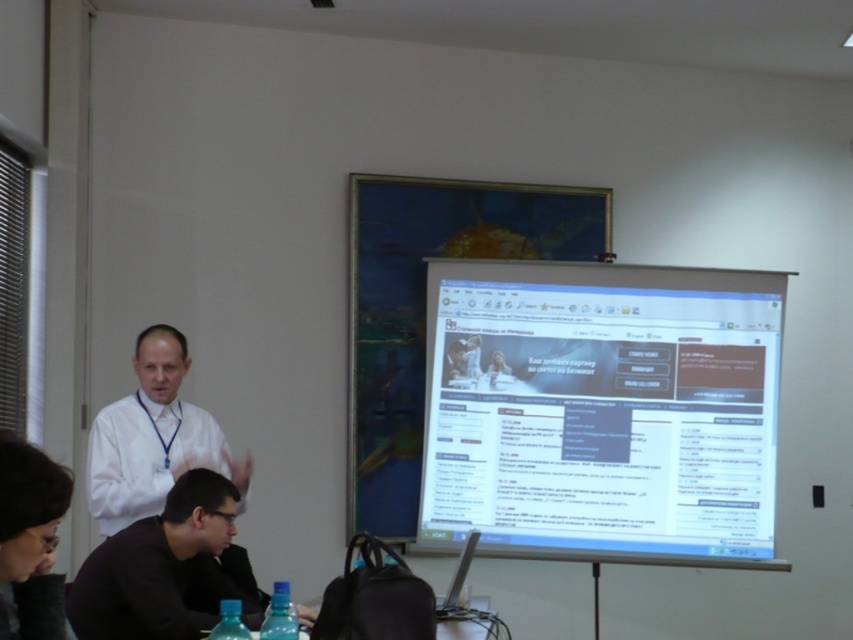
You are a person who wants to present a slide on the white glossy screen at center without blocking the black matte jacket at lower center. Can you stand between them and still be visible to the audience?

The white glossy screen at center and black matte jacket at lower center are 5.58 feet apart from each other. If you stand between them, you need to ensure that your position allows the audience to see both you and the screen. Since the distance is 5.58 feet, standing near the screen side would keep you visible while avoiding blocking the jacket.

You are sitting at the table and want to look at the white glossy screen at center and the black matte jacket at lower center. Which object is located to the right side from your perspective?

The white glossy screen at center is to the right of the black matte jacket at lower center, so from your perspective, the white glossy screen at center is on the right side.

You are organizing a photoshoot and need to place a mannequin wearing a red scarf between the black matte jacket at lower center and the white shirt at left. Based on their sizes, which side should the mannequin be placed closer to?

The black matte jacket at lower center is smaller than the white shirt at left, so the mannequin should be placed closer to the white shirt at left to maintain balance between the two objects.